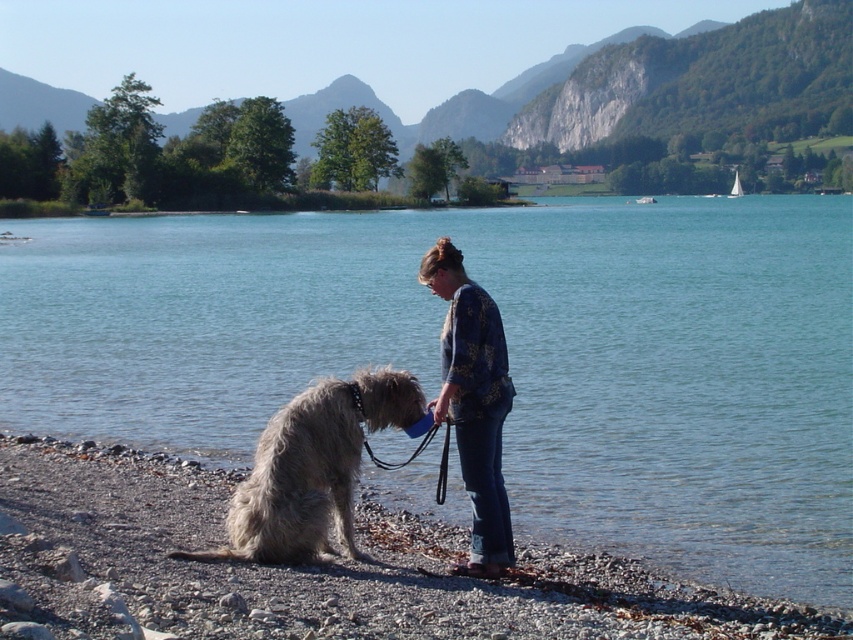
Between point (398, 381) and point (436, 406), which one is positioned behind?

The point (398, 381) is more distant.

What do you see at coordinates (312, 468) in the screenshot? Image resolution: width=853 pixels, height=640 pixels. I see `gray shaggy fur at lower left` at bounding box center [312, 468].

What do you see at coordinates (312, 468) in the screenshot?
I see `gray shaggy fur at lower left` at bounding box center [312, 468].

Find the location of `gray shaggy fur at lower left`. gray shaggy fur at lower left is located at coordinates coord(312,468).

Is clear blue water at center wider than smooth pebbles shoreline at lower left?

Yes.

Identify the location of clear blue water at center. This screenshot has height=640, width=853. (508, 352).

Is smooth pebbles shoreline at lower left bigger than floral-patterned fabric at center?

Yes, smooth pebbles shoreline at lower left is bigger than floral-patterned fabric at center.

Which is behind, point (131, 609) or point (485, 340)?

The point (485, 340) is more distant.

Who is more distant from viewer, (793, 611) or (477, 305)?

The point (477, 305) is behind.

Image resolution: width=853 pixels, height=640 pixels. I want to click on smooth pebbles shoreline at lower left, so click(316, 568).